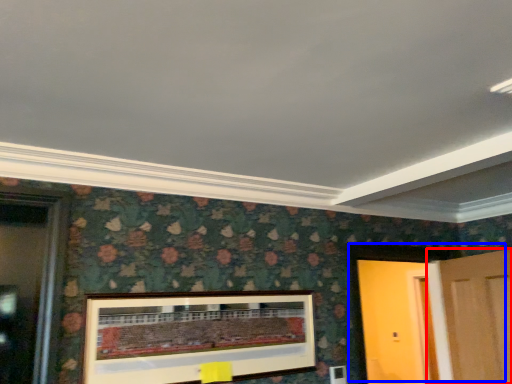
Question: Which of the following is the closest to the observer, door (highlighted by a red box) or door (highlighted by a blue box)?

Choices:
 (A) door
 (B) door

Answer: (A)